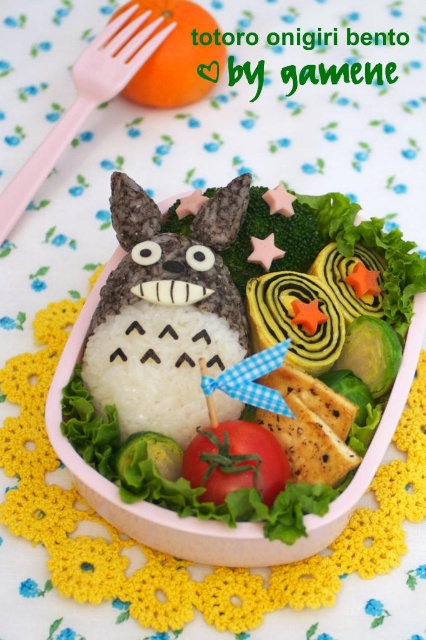
Where is the white rice at center located in the bento box?

The white rice at center is located at point (212,520) in the bento box.

You are a food critic reviewing this Totoro bento box. You need to describe the spatial relationship between the white rice at center and the orange matte at upper left. How far apart are they?

The white rice at center is 22.58 inches away from the orange matte at upper left.

You are a food critic visiting a Japanese restaurant and see the white rice at center and the pink plastic fork at upper left on the bento box. Which object is bigger in size?

The white rice at center is larger in size compared to the pink plastic fork at upper left.